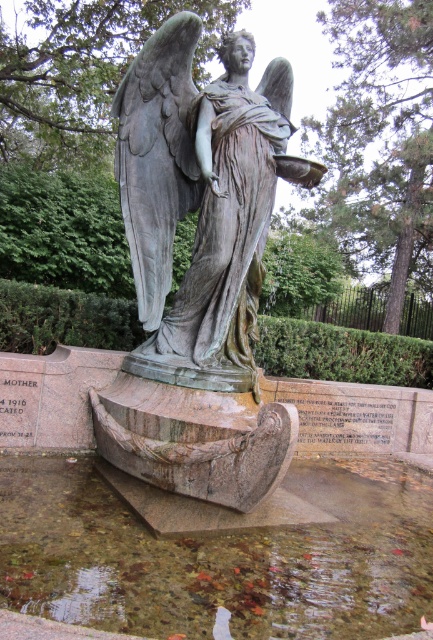
Can you confirm if clear glass water at center is shorter than bronze statue at center?

Correct, clear glass water at center is not as tall as bronze statue at center.

Is point (7, 496) farther from camera compared to point (177, 189)?

No, (7, 496) is in front of (177, 189).

Find the location of a particular element. clear glass water at center is located at coordinates (219, 556).